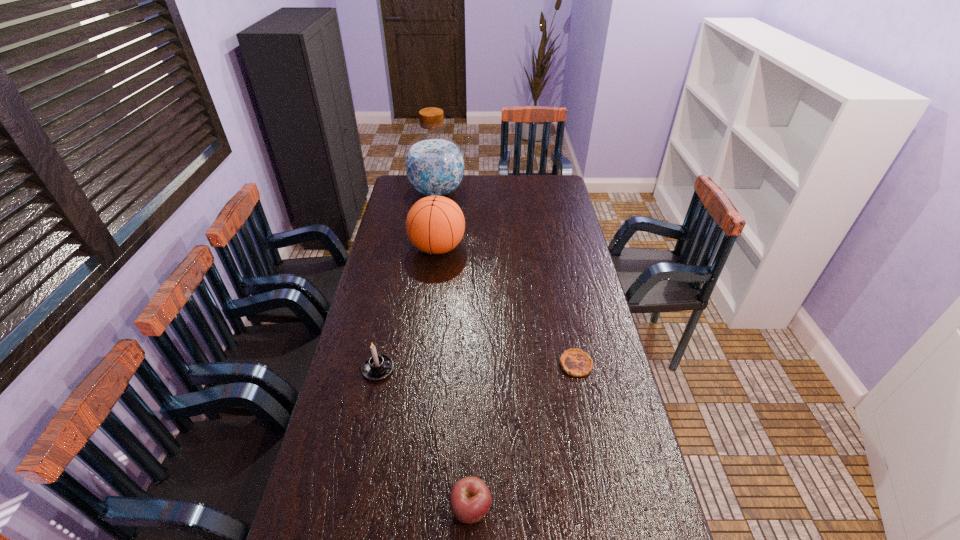
Identify the location of object that is the second closest to the apple. (575, 362).

The height and width of the screenshot is (540, 960). I want to click on object that is the nearest to the farthest object, so click(435, 224).

Locate an element on the screen. Image resolution: width=960 pixels, height=540 pixels. free spot that satisfies the following two spatial constraints: 1. on the front side of the tallest object; 2. on the left side of the fourth nearest object is located at coordinates (429, 248).